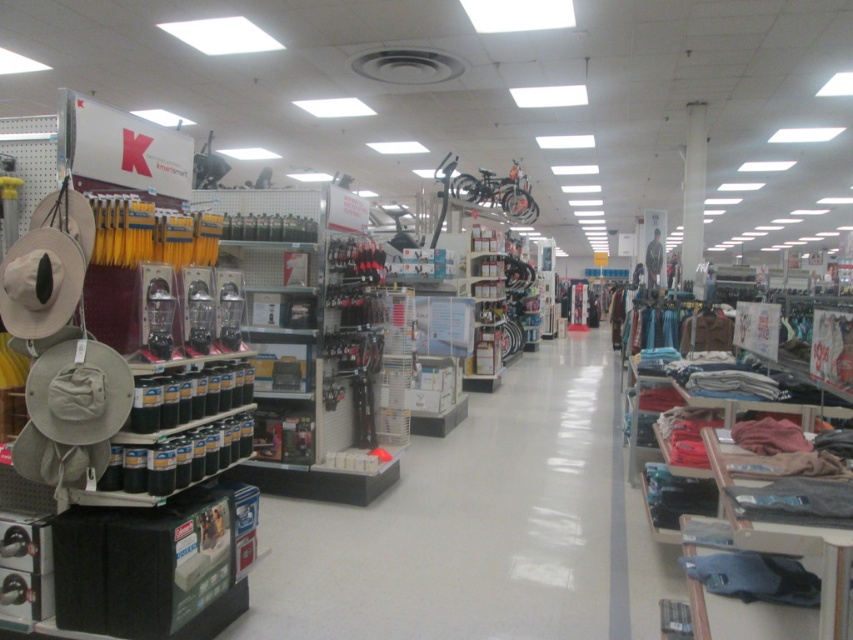
You are a customer in a Kmart store looking to buy clothing. You see a denim fabric pants at lower right and a camouflage fabric shirt at center. Which clothing item is narrower in width?

The denim fabric pants at lower right are narrower in width than the camouflage fabric shirt at center.

You are a customer in the Kmart store looking for clothing items. You see a denim fabric pants at lower right and a camouflage fabric shirt at center. Which clothing item is positioned lower in the store?

The denim fabric pants at lower right is located below the camouflage fabric shirt at center, so the denim fabric pants at lower right is positioned lower in the store.

You are a customer in the Kmart store shown. You see the denim fabric pants at lower right. Can you reach them from where you are standing if you can move 3 meters?

The denim fabric pants at lower right are 3.00 meters away. Since you can move 3 meters, you can reach them.